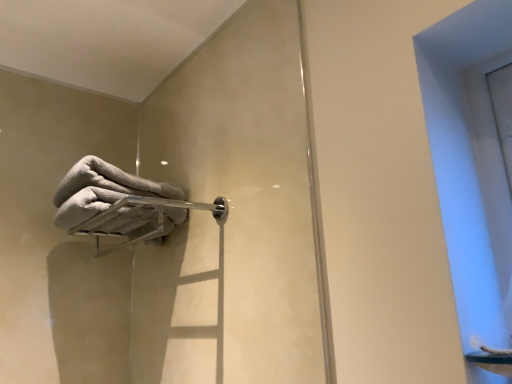
Question: In the image, is transparent glass window at upper right positioned in front of or behind silver metallic towel bar at upper left?

Choices:
 (A) front
 (B) behind

Answer: (A)

Question: In terms of width, does transparent glass window at upper right look wider or thinner when compared to silver metallic towel bar at upper left?

Choices:
 (A) thin
 (B) wide

Answer: (A)

Question: Which is nearer to the silver metallic towel bar at upper left?

Choices:
 (A) transparent glass window at upper right
 (B) white fluffy towel at upper left

Answer: (B)

Question: Which of these objects is positioned farthest from the silver metallic towel bar at upper left?

Choices:
 (A) transparent glass window at upper right
 (B) white fluffy towel at upper left

Answer: (A)